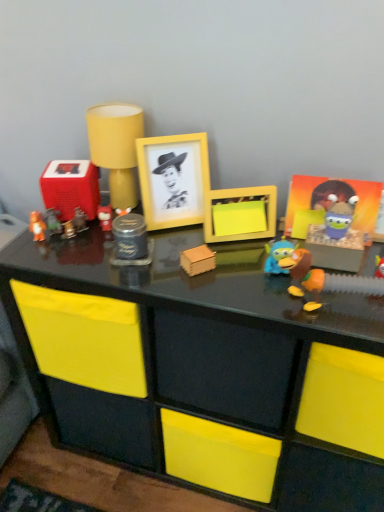
Where is `unoccupied area in front of wooden block at center, positioned as the ninth toy in left-to-right order`? The image size is (384, 512). unoccupied area in front of wooden block at center, positioned as the ninth toy in left-to-right order is located at coordinates (223, 302).